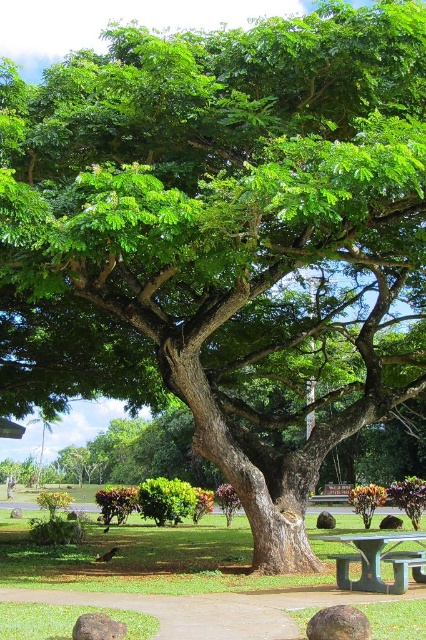
Question: Based on their relative distances, which object is farther from the metallic silver bench at lower right?

Choices:
 (A) green leafy tree at center
 (B) green plastic picnic table at lower center

Answer: (A)

Question: Which point is closer to the camera?

Choices:
 (A) (402, 573)
 (B) (199, 582)
 (C) (337, 540)

Answer: (A)

Question: Does green plastic picnic table at lower center appear over metallic silver bench at lower right?

Choices:
 (A) no
 (B) yes

Answer: (B)

Question: Can you confirm if green leafy tree at center is positioned above metallic silver bench at lower right?

Choices:
 (A) no
 (B) yes

Answer: (A)

Question: Which object is positioned farthest from the green leafy tree at center?

Choices:
 (A) green plastic picnic table at lower center
 (B) metallic silver bench at lower right

Answer: (A)

Question: Does green leafy tree at center appear under green plastic picnic table at lower center?

Choices:
 (A) yes
 (B) no

Answer: (A)